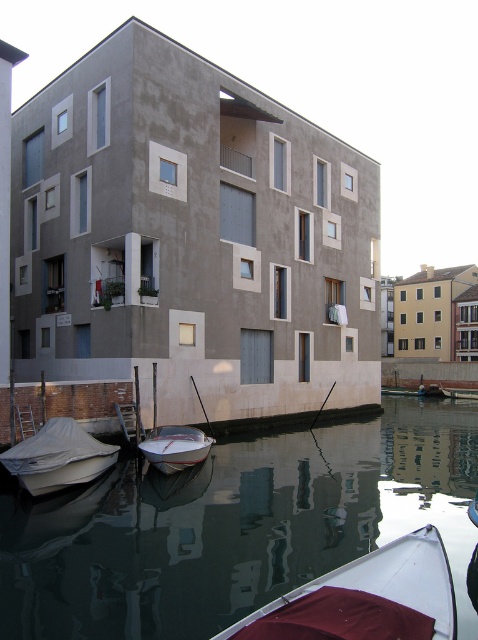
You are standing on the dock and want to know which object is wider between the smooth reflective water at lower center and the white matte boat at lower left. Which one is wider?

The smooth reflective water at lower center is wider than the white matte boat at lower left according to the description.

Based on the photo, you are standing on the dock and want to take a photo of the smooth reflective water at lower center. According to the coordinates provided, what are the exact coordinates where you should aim your camera?

The smooth reflective water at lower center is located at coordinates point (x=236, y=525).